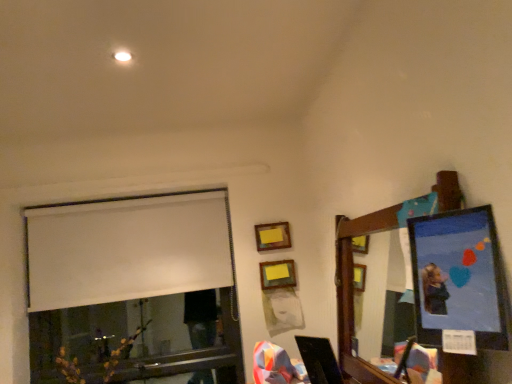
Question: Is wooden mirror at upper right wider or thinner than wooden picture frame at upper center, which is the 3th picture frame in right-to-left order?

Choices:
 (A) wide
 (B) thin

Answer: (A)

Question: From their relative heights in the image, would you say wooden mirror at upper right is taller or shorter than wooden picture frame at upper center, the 1th picture frame when ordered from back to front?

Choices:
 (A) tall
 (B) short

Answer: (A)

Question: Which of these objects is positioned closest to the wooden matte picture frame at upper center, which appears as the second picture frame when viewed from the right?

Choices:
 (A) matte plastic picture frame at upper right, the 3th picture frame viewed from the left
 (B) white matte window at upper left
 (C) wooden mirror at upper right
 (D) wooden picture frame at upper center, acting as the 1th picture frame starting from the left

Answer: (D)

Question: Which is nearer to the wooden picture frame at upper center, positioned as the third picture frame in front-to-back order?

Choices:
 (A) white matte window at upper left
 (B) wooden mirror at upper right
 (C) matte plastic picture frame at upper right, placed as the 1th picture frame when sorted from right to left
 (D) wooden matte picture frame at upper center, the 2th picture frame positioned from the back

Answer: (D)